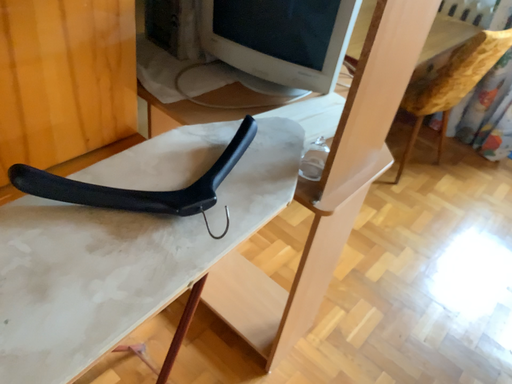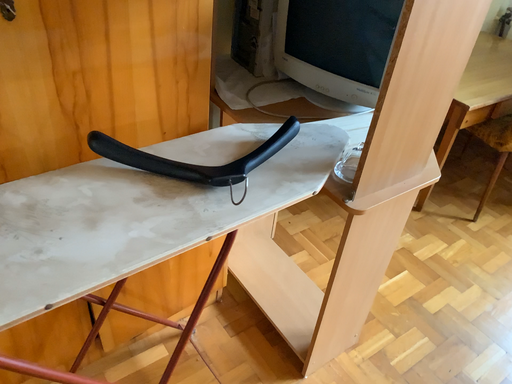
Question: How did the camera likely rotate when shooting the video?

Choices:
 (A) rotated right
 (B) rotated left

Answer: (B)